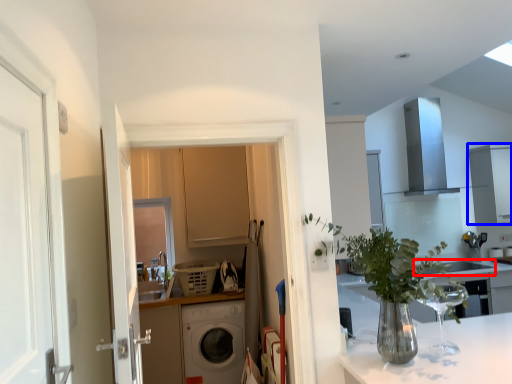
Question: Among these objects, which one is farthest to the camera, sink (highlighted by a red box) or cabinetry (highlighted by a blue box)?

Choices:
 (A) sink
 (B) cabinetry

Answer: (B)